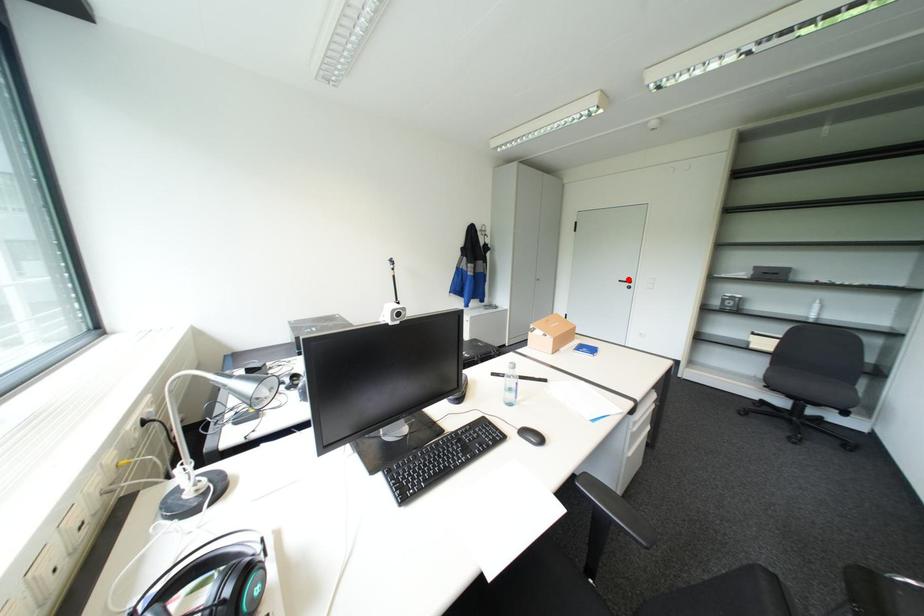
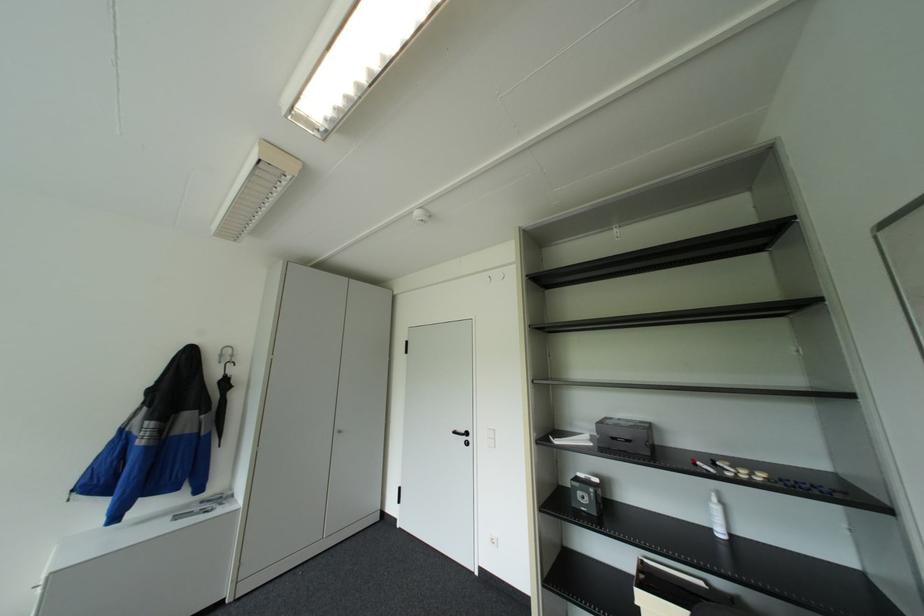
Locate, in the second image, the point that corresponds to the highlighted location in the first image.

(463, 431)